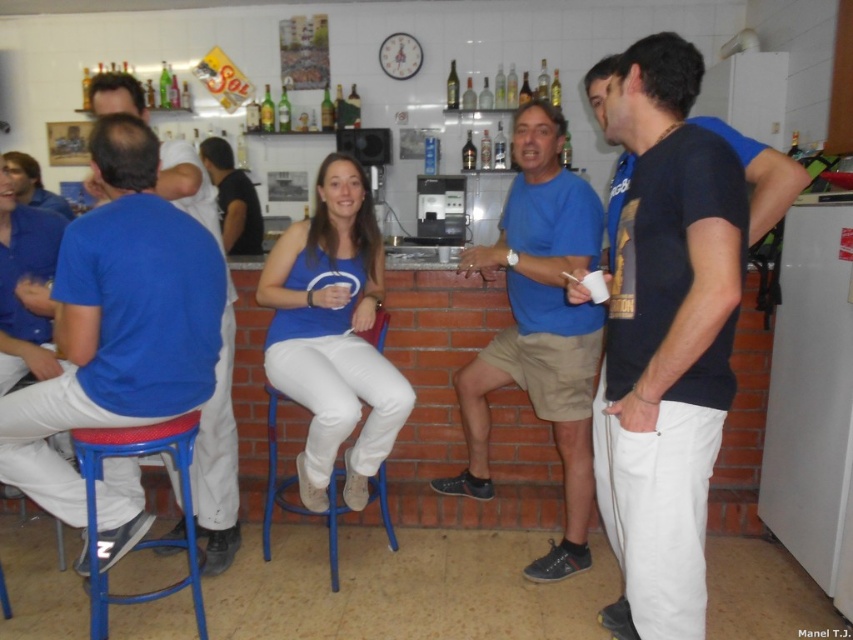
Looking at this image, is black matte t-shirt at center below blue plastic stool at lower left?

No, black matte t-shirt at center is not below blue plastic stool at lower left.

The height and width of the screenshot is (640, 853). What do you see at coordinates (666, 339) in the screenshot?
I see `black matte t-shirt at center` at bounding box center [666, 339].

Where is `black matte t-shirt at center`? Image resolution: width=853 pixels, height=640 pixels. black matte t-shirt at center is located at coordinates (666, 339).

Between blue cotton shirt at center and black cotton shirt at center, which one is positioned higher?

black cotton shirt at center is above.

Between blue cotton shirt at center and black cotton shirt at center, which one appears on the right side from the viewer's perspective?

blue cotton shirt at center

Describe the element at coordinates (538, 326) in the screenshot. I see `blue cotton shirt at center` at that location.

Locate an element on the screen. blue cotton shirt at center is located at coordinates (538, 326).

Which is more to the left, black matte t-shirt at center or matte blue tank top at center?

matte blue tank top at center is more to the left.

Which is behind, point (695, 148) or point (329, 426)?

Point (329, 426)

Does point (653, 401) come closer to viewer compared to point (318, 422)?

Yes, point (653, 401) is closer to viewer.

Where is `black matte t-shirt at center`? black matte t-shirt at center is located at coordinates (666, 339).